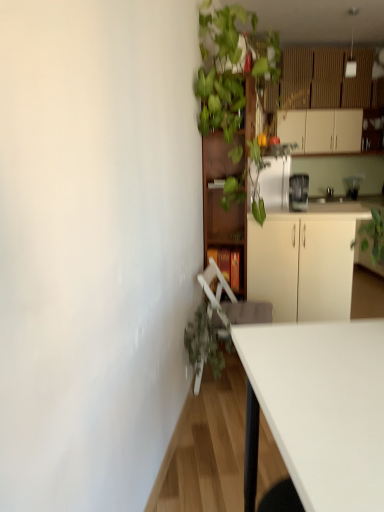
Question: Should I look upward or downward to see green leafy plant at upper center?

Choices:
 (A) up
 (B) down

Answer: (A)

Question: From the image's perspective, is satin silver blender at upper right, which is counted as the 2th appliance, starting from the right, over white matte cabinet at upper right, acting as the first cabinetry starting from the top?

Choices:
 (A) no
 (B) yes

Answer: (A)

Question: Does satin silver blender at upper right, marked as the 2th appliance in a top-to-bottom arrangement, have a greater height compared to white matte cabinet at upper right, the first cabinetry when ordered from right to left?

Choices:
 (A) yes
 (B) no

Answer: (B)

Question: From a real-world perspective, is satin silver blender at upper right, marked as the 2th appliance in a top-to-bottom arrangement, on top of white matte cabinet at upper right, which ranks as the 3th cabinetry in front-to-back order?

Choices:
 (A) yes
 (B) no

Answer: (B)

Question: Would you say satin silver blender at upper right, arranged as the first appliance when viewed from the left, is a long distance from white matte cabinet at upper right, which is the first cabinetry from back to front?

Choices:
 (A) yes
 (B) no

Answer: (A)

Question: Does satin silver blender at upper right, positioned as the second appliance in back-to-front order, have a lesser width compared to white matte cabinet at upper right, the 3th cabinetry from the bottom?

Choices:
 (A) no
 (B) yes

Answer: (B)

Question: Considering the relative sizes of satin silver blender at upper right, arranged as the first appliance when viewed from the left, and white matte cabinet at upper right, marked as the third cabinetry in a left-to-right arrangement, in the image provided, is satin silver blender at upper right, arranged as the first appliance when viewed from the left, bigger than white matte cabinet at upper right, marked as the third cabinetry in a left-to-right arrangement,?

Choices:
 (A) no
 (B) yes

Answer: (A)

Question: Considering the relative sizes of clear glass blender at upper right, which ranks as the 1th appliance in top-to-bottom order, and brown wooden bookshelf at center, which appears as the 3th cabinetry when viewed from the right, in the image provided, is clear glass blender at upper right, which ranks as the 1th appliance in top-to-bottom order, shorter than brown wooden bookshelf at center, which appears as the 3th cabinetry when viewed from the right,?

Choices:
 (A) yes
 (B) no

Answer: (A)

Question: Is the position of clear glass blender at upper right, the second appliance positioned from the left, more distant than that of brown wooden bookshelf at center, arranged as the first cabinetry when viewed from the left?

Choices:
 (A) yes
 (B) no

Answer: (A)

Question: Is clear glass blender at upper right, the second appliance positioned from the left, closer to the viewer compared to brown wooden bookshelf at center, the 3th cabinetry from the top?

Choices:
 (A) no
 (B) yes

Answer: (A)

Question: Considering the relative positions of clear glass blender at upper right, which ranks as the 1th appliance in top-to-bottom order, and brown wooden bookshelf at center, positioned as the second cabinetry in back-to-front order, in the image provided, is clear glass blender at upper right, which ranks as the 1th appliance in top-to-bottom order, to the right of brown wooden bookshelf at center, positioned as the second cabinetry in back-to-front order, from the viewer's perspective?

Choices:
 (A) no
 (B) yes

Answer: (B)

Question: Considering the relative sizes of clear glass blender at upper right, marked as the 2th appliance in a bottom-to-top arrangement, and brown wooden bookshelf at center, the 3th cabinetry from the top, in the image provided, is clear glass blender at upper right, marked as the 2th appliance in a bottom-to-top arrangement, taller than brown wooden bookshelf at center, the 3th cabinetry from the top,?

Choices:
 (A) no
 (B) yes

Answer: (A)

Question: Are clear glass blender at upper right, marked as the 2th appliance in a bottom-to-top arrangement, and brown wooden bookshelf at center, placed as the 2th cabinetry when sorted from front to back, making contact?

Choices:
 (A) no
 (B) yes

Answer: (A)

Question: Is white matte cabinet at center, placed as the second cabinetry when sorted from right to left, located outside green leafy plant at upper center?

Choices:
 (A) yes
 (B) no

Answer: (A)